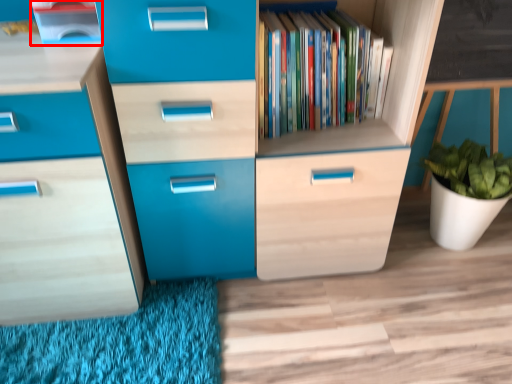
Question: From the image's perspective, where is cabinetry (annotated by the red box) located relative to shelf?

Choices:
 (A) above
 (B) below

Answer: (A)